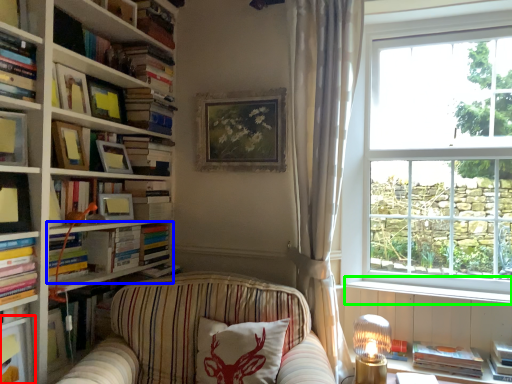
Question: Considering the real-world distances, which object is farthest from shelf (highlighted by a red box)? book (highlighted by a blue box) or window sill (highlighted by a green box)?

Choices:
 (A) book
 (B) window sill

Answer: (B)